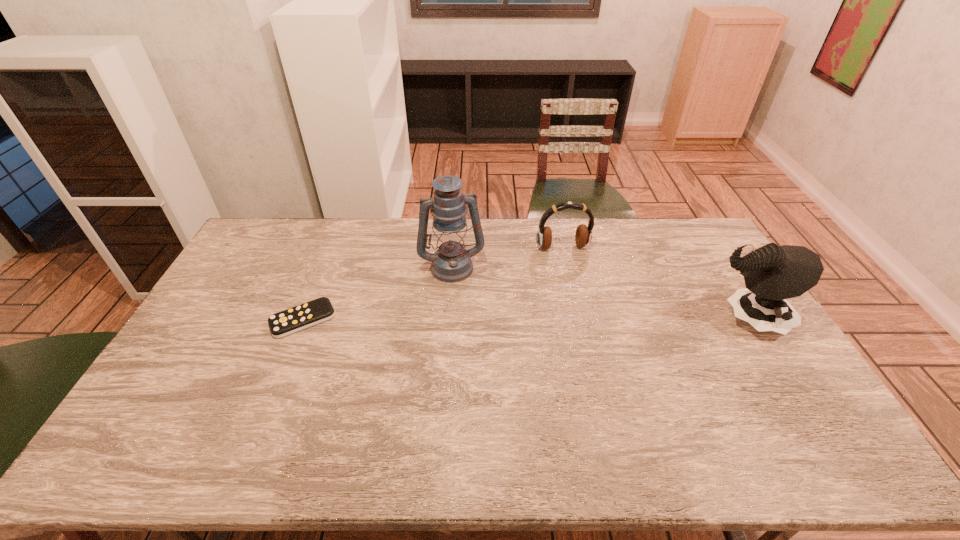
This screenshot has width=960, height=540. In order to click on free spot on the desktop that is between the remote control and the doll and is positioned on the ear cup of the headset in this screenshot , I will do point(589,320).

You are a GUI agent. You are given a task and a screenshot of the screen. Output one action in this format:
    pyautogui.click(x=<x>, y=<y>)
    Task: Click on the vacant space on the desktop that is between the leftmost object and the second tallest object and is positioned on the front-facing side of the tallest object
    The width and height of the screenshot is (960, 540).
    Given the screenshot: What is the action you would take?
    pyautogui.click(x=464, y=320)